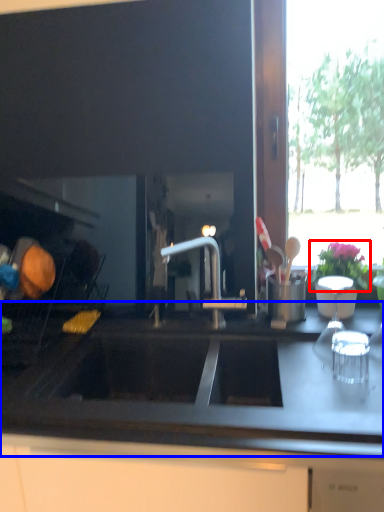
Question: Among these objects, which one is farthest to the camera, flower (highlighted by a red box) or countertop (highlighted by a blue box)?

Choices:
 (A) flower
 (B) countertop

Answer: (A)